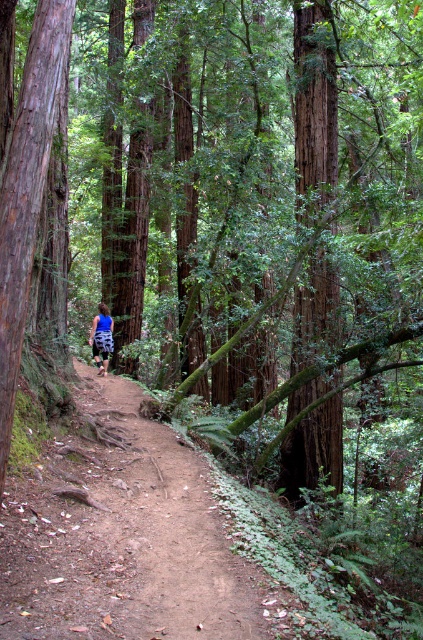
Question: Which point is closer to the camera taking this photo?

Choices:
 (A) (145, 518)
 (B) (91, 349)

Answer: (A)

Question: In this image, where is dirt path at center located relative to blue printed shorts at center?

Choices:
 (A) right
 (B) left

Answer: (A)

Question: Can you confirm if dirt path at center is positioned to the right of blue printed shorts at center?

Choices:
 (A) yes
 (B) no

Answer: (A)

Question: Which point is closer to the camera taking this photo?

Choices:
 (A) tap(98, 358)
 (B) tap(131, 608)

Answer: (B)

Question: From the image, what is the correct spatial relationship of dirt path at center in relation to blue printed shorts at center?

Choices:
 (A) left
 (B) right

Answer: (B)